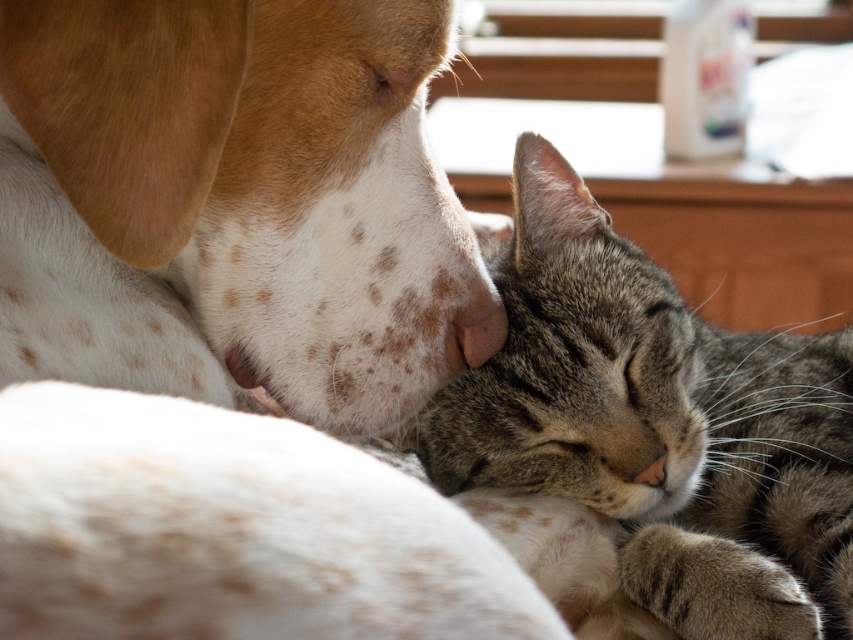
You are a photographer standing 36 inches away from the gray striped fur at center. Can you reach it without moving your feet?

The gray striped fur at center is 30.53 inches away from the viewer. Since you are standing 36 inches away, you are farther than the required distance, so you cannot reach it without moving closer.

You are a pet sitter who needs to place a 12 inch long toy between the spotted fur dog at upper left and the gray striped fur at center. Can the toy fit in the space between them?

The distance between the spotted fur dog at upper left and the gray striped fur at center is 11.65 inches. Since the toy is 12 inches long, it cannot fit in the space between them as the available space is slightly smaller than the toy.